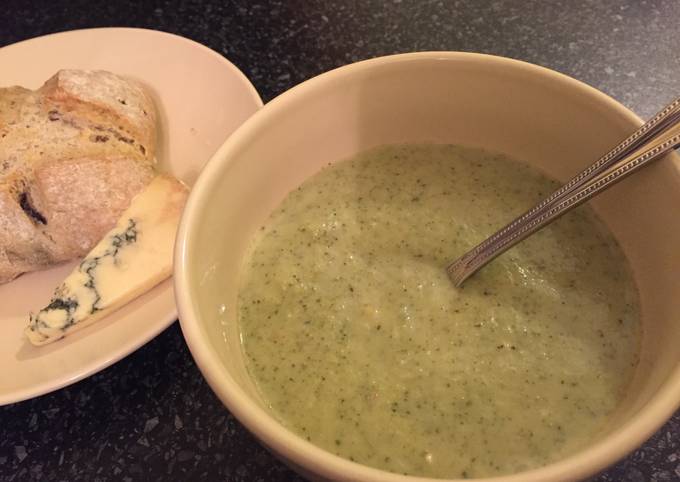
I want to click on edge of white plate, so click(120, 355), click(158, 32).